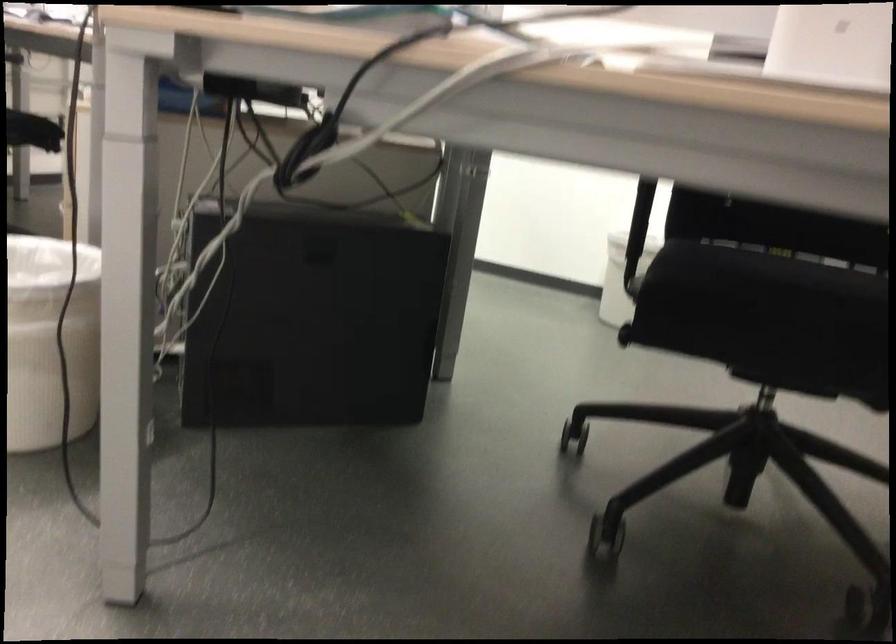
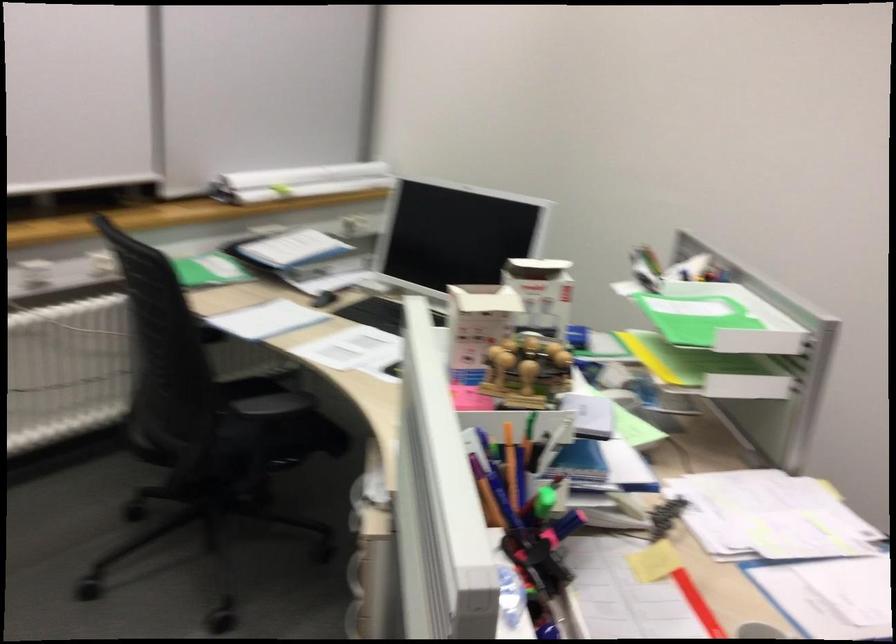
In a continuous first-person perspective shot, in which direction is the camera moving?

The cameraman moved toward left, forward.